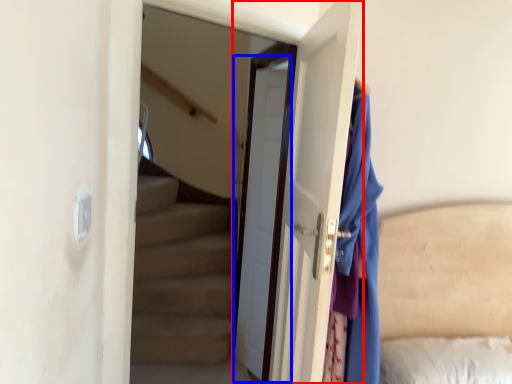
Question: Which of the following is the farthest to the observer, door (highlighted by a red box) or door (highlighted by a blue box)?

Choices:
 (A) door
 (B) door

Answer: (B)